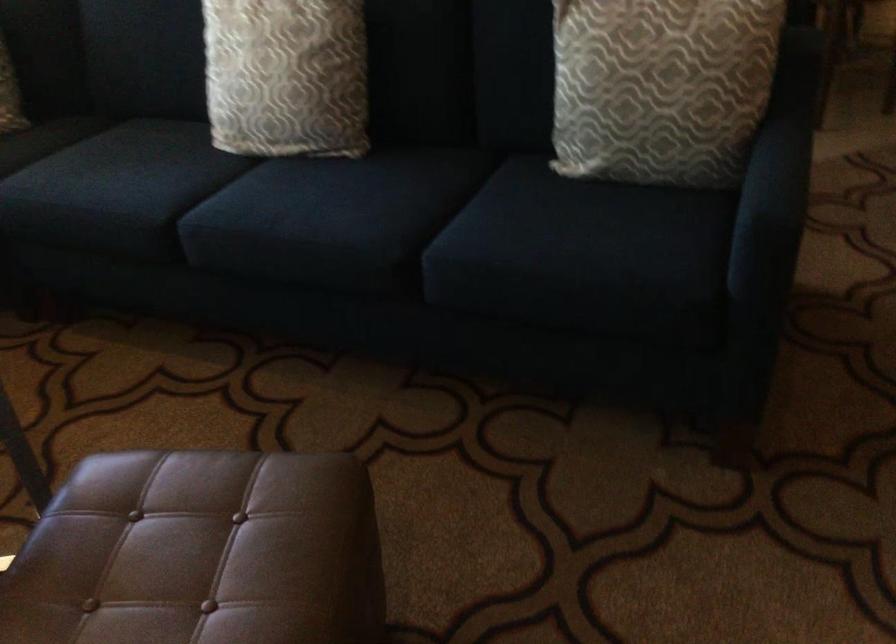
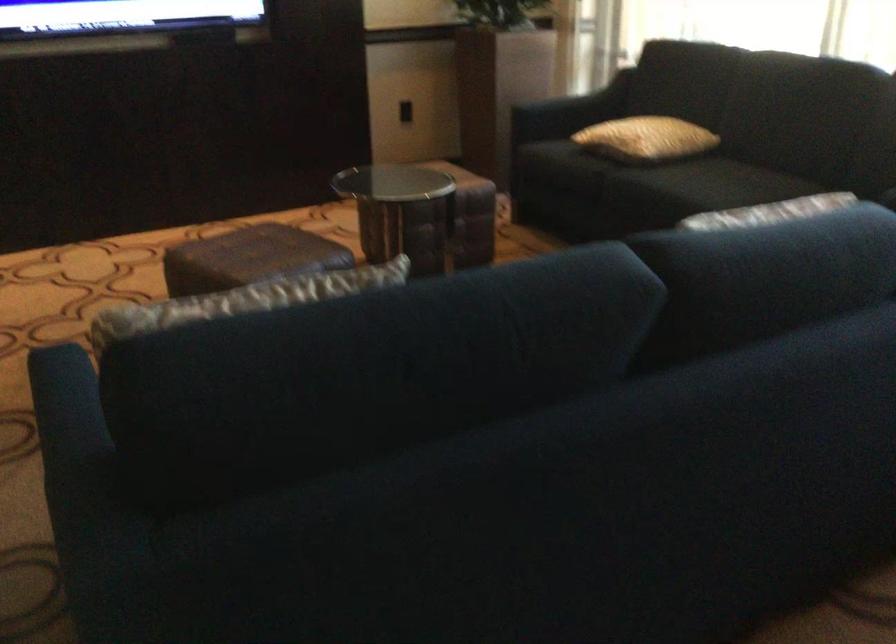
Find the pixel in the second image that matches pixel 769 136 in the first image.

(69, 431)